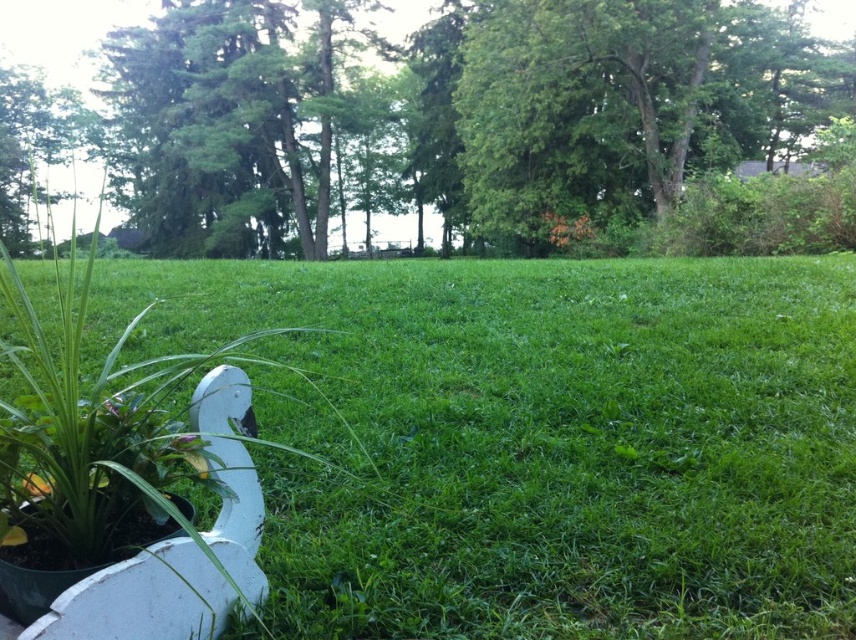
You are an artist setting up an easel to paint the scene. You want to ensure the green leafy tree at upper left and the orange matte flower at center are both visible in your painting. Given their sizes, which object should you place closer to the center of your canvas to maintain balance?

The green leafy tree at upper left should be placed closer to the center of the canvas because it has a larger size compared to the orange matte flower at center, helping to balance the composition.

You are standing in the park and want to take a photo of the green leafy tree at upper left and the green matte flower at lower left. Which object should you focus on first to ensure both are in clear view?

You should focus on the green leafy tree at upper left first because it is closer to you than the green matte flower at lower left, ensuring both are in clear view when focused properly.